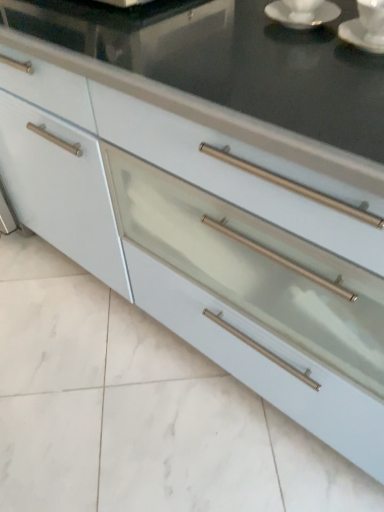
This screenshot has width=384, height=512. I want to click on white ceramic saucer at upper right, the 1th saucer viewed from the right, so click(358, 36).

Describe the element at coordinates (302, 15) in the screenshot. I see `white glossy saucer at upper right, which is counted as the first saucer, starting from the left` at that location.

This screenshot has width=384, height=512. I want to click on white glossy saucer at upper right, so click(302, 15).

Could you measure the distance between satin white drawer at center and white glossy saucer at upper right, which appears as the second saucer when viewed from the right?

satin white drawer at center and white glossy saucer at upper right, which appears as the second saucer when viewed from the right, are 28.12 inches apart from each other.

Can you tell me how much satin white drawer at center and white glossy saucer at upper right, which is counted as the first saucer, starting from the left, differ in facing direction?

The facing directions of satin white drawer at center and white glossy saucer at upper right, which is counted as the first saucer, starting from the left, are 91.6 degrees apart.

Does point (208, 310) appear closer or farther from the camera than point (290, 20)?

Point (208, 310).

From a real-world perspective, which object rests below the other?

satin white drawer at center is physically lower.

Which object is more forward, white glossy saucer at upper right, which appears as the second saucer when viewed from the right, or white glossy saucer at upper right?

white glossy saucer at upper right, which appears as the second saucer when viewed from the right, is in front.

Which is correct: white glossy saucer at upper right, which is counted as the first saucer, starting from the left, is inside white glossy saucer at upper right, or outside of it?

white glossy saucer at upper right, which is counted as the first saucer, starting from the left, is not enclosed by white glossy saucer at upper right.

How different are the orientations of white glossy saucer at upper right, which appears as the second saucer when viewed from the right, and white glossy saucer at upper right in degrees?

The facing directions of white glossy saucer at upper right, which appears as the second saucer when viewed from the right, and white glossy saucer at upper right are 3.01 degrees apart.

How far apart are white glossy saucer at upper right, which is counted as the first saucer, starting from the left, and white glossy saucer at upper right?

The distance of white glossy saucer at upper right, which is counted as the first saucer, starting from the left, from white glossy saucer at upper right is 0.98 inches.

In the image, is white ceramic saucer at upper right, which is the second saucer in left-to-right order, positioned in front of or behind white glossy saucer at upper right?

In the image, white ceramic saucer at upper right, which is the second saucer in left-to-right order, appears in front of white glossy saucer at upper right.

How different are the orientations of white ceramic saucer at upper right, the 1th saucer viewed from the right, and white glossy saucer at upper right in degrees?

There is a 2.2-degree angle between the facing directions of white ceramic saucer at upper right, the 1th saucer viewed from the right, and white glossy saucer at upper right.

From the image's perspective, is white ceramic saucer at upper right, which is the second saucer in left-to-right order, above white glossy saucer at upper right?

Actually, white ceramic saucer at upper right, which is the second saucer in left-to-right order, appears below white glossy saucer at upper right in the image.

From a real-world perspective, between white ceramic saucer at upper right, which is the second saucer in left-to-right order, and white glossy saucer at upper right, who is vertically lower?

From a 3D spatial view, white glossy saucer at upper right is below.

How different are the orientations of satin white drawer at center and white ceramic saucer at upper right, which is the second saucer in left-to-right order, in degrees?

The angular difference between satin white drawer at center and white ceramic saucer at upper right, which is the second saucer in left-to-right order, is 90.8 degrees.

Consider the image. Is satin white drawer at center in front of or behind white ceramic saucer at upper right, the 1th saucer viewed from the right, in the image?

satin white drawer at center is behind white ceramic saucer at upper right, the 1th saucer viewed from the right.

Is white ceramic saucer at upper right, the 1th saucer viewed from the right, at the back of satin white drawer at center?

No, satin white drawer at center is not facing away from white ceramic saucer at upper right, the 1th saucer viewed from the right.

Locate an element on the screen. This screenshot has width=384, height=512. tea set that appears above the satin white drawer at center (from the image's perspective) is located at coordinates (302, 15).

Does satin white drawer at center appear on the left side of white glossy saucer at upper right?

Correct, you'll find satin white drawer at center to the left of white glossy saucer at upper right.

Which of these two, white glossy saucer at upper right, which appears as the second saucer when viewed from the right, or satin white drawer at center, is bigger?

With larger size is satin white drawer at center.

Considering the relative sizes of white glossy saucer at upper right, which appears as the second saucer when viewed from the right, and satin white drawer at center in the image provided, is white glossy saucer at upper right, which appears as the second saucer when viewed from the right, shorter than satin white drawer at center?

No.

From the image's perspective, is white glossy saucer at upper right, which appears as the second saucer when viewed from the right, positioned above or below satin white drawer at center?

white glossy saucer at upper right, which appears as the second saucer when viewed from the right, is above satin white drawer at center.

From a real-world perspective, relative to satin white drawer at center, is white glossy saucer at upper right, which is counted as the first saucer, starting from the left, vertically above or below?

From a real-world perspective, white glossy saucer at upper right, which is counted as the first saucer, starting from the left, is physically above satin white drawer at center.

Considering the sizes of white glossy saucer at upper right and white glossy saucer at upper right, which appears as the second saucer when viewed from the right, in the image, is white glossy saucer at upper right bigger or smaller than white glossy saucer at upper right, which appears as the second saucer when viewed from the right,?

Considering their sizes, white glossy saucer at upper right takes up less space than white glossy saucer at upper right, which appears as the second saucer when viewed from the right.

From their relative heights in the image, would you say white glossy saucer at upper right is taller or shorter than white glossy saucer at upper right, which is counted as the first saucer, starting from the left?

Clearly, white glossy saucer at upper right is shorter compared to white glossy saucer at upper right, which is counted as the first saucer, starting from the left.

Between white glossy saucer at upper right and white glossy saucer at upper right, which is counted as the first saucer, starting from the left, which one has larger width?

Wider between the two is white glossy saucer at upper right.

In the scene shown: Are white glossy saucer at upper right and white glossy saucer at upper right, which appears as the second saucer when viewed from the right, making contact?

Yes, the surface of white glossy saucer at upper right is in contact with white glossy saucer at upper right, which appears as the second saucer when viewed from the right.

In order to click on drawer below the white glossy saucer at upper right, which is counted as the first saucer, starting from the left (from a real-world perspective) in this screenshot , I will do `click(263, 362)`.

From a real-world perspective, count 2nd saucers upward from the white glossy saucer at upper right and point to it. Please provide its 2D coordinates.

[(302, 15)]

Estimate the real-world distances between objects in this image. Which object is closer to white ceramic saucer at upper right, the 1th saucer viewed from the right, satin white drawer at center or white glossy saucer at upper right, which is counted as the first saucer, starting from the left?

Based on the image, white glossy saucer at upper right, which is counted as the first saucer, starting from the left, appears to be nearer to white ceramic saucer at upper right, the 1th saucer viewed from the right.

Estimate the real-world distances between objects in this image. Which object is further from white ceramic saucer at upper right, which is the second saucer in left-to-right order, satin white drawer at center or white glossy saucer at upper right?

Based on the image, satin white drawer at center appears to be further to white ceramic saucer at upper right, which is the second saucer in left-to-right order.

From the picture: Which object lies nearer to the anchor point white glossy saucer at upper right, white ceramic saucer at upper right, which is the second saucer in left-to-right order, or satin white drawer at center?

white ceramic saucer at upper right, which is the second saucer in left-to-right order, is positioned closer to the anchor white glossy saucer at upper right.

In the scene shown: Looking at the image, which one is located closer to satin white drawer at center, white glossy saucer at upper right, which appears as the second saucer when viewed from the right, or white glossy saucer at upper right?

white glossy saucer at upper right.

From the image, which object appears to be nearer to white ceramic saucer at upper right, the 1th saucer viewed from the right, white glossy saucer at upper right or satin white drawer at center?

Based on the image, white glossy saucer at upper right appears to be nearer to white ceramic saucer at upper right, the 1th saucer viewed from the right.

Considering their positions, is white ceramic saucer at upper right, the 1th saucer viewed from the right, positioned closer to satin white drawer at center than white glossy saucer at upper right, which appears as the second saucer when viewed from the right?

Among the two, white ceramic saucer at upper right, the 1th saucer viewed from the right, is located nearer to satin white drawer at center.

Looking at the image, which one is located closer to satin white drawer at center, white glossy saucer at upper right or white glossy saucer at upper right, which is counted as the first saucer, starting from the left?

Among the two, white glossy saucer at upper right is located nearer to satin white drawer at center.

From the image, which object appears to be nearer to white ceramic saucer at upper right, the 1th saucer viewed from the right, white glossy saucer at upper right or white glossy saucer at upper right, which appears as the second saucer when viewed from the right?

white glossy saucer at upper right is positioned closer to the anchor white ceramic saucer at upper right, the 1th saucer viewed from the right.

What are the coordinates of `tea set between white glossy saucer at upper right, which is counted as the first saucer, starting from the left, and satin white drawer at center from top to bottom` in the screenshot? It's located at (302, 15).

This screenshot has width=384, height=512. In order to click on saucer between white glossy saucer at upper right, which appears as the second saucer when viewed from the right, and satin white drawer at center vertically in this screenshot , I will do `click(358, 36)`.

Identify the location of saucer located between white glossy saucer at upper right and white ceramic saucer at upper right, which is the second saucer in left-to-right order, in the left-right direction. (302, 15).

In order to click on saucer between white glossy saucer at upper right and satin white drawer at center in the vertical direction in this screenshot , I will do `click(358, 36)`.